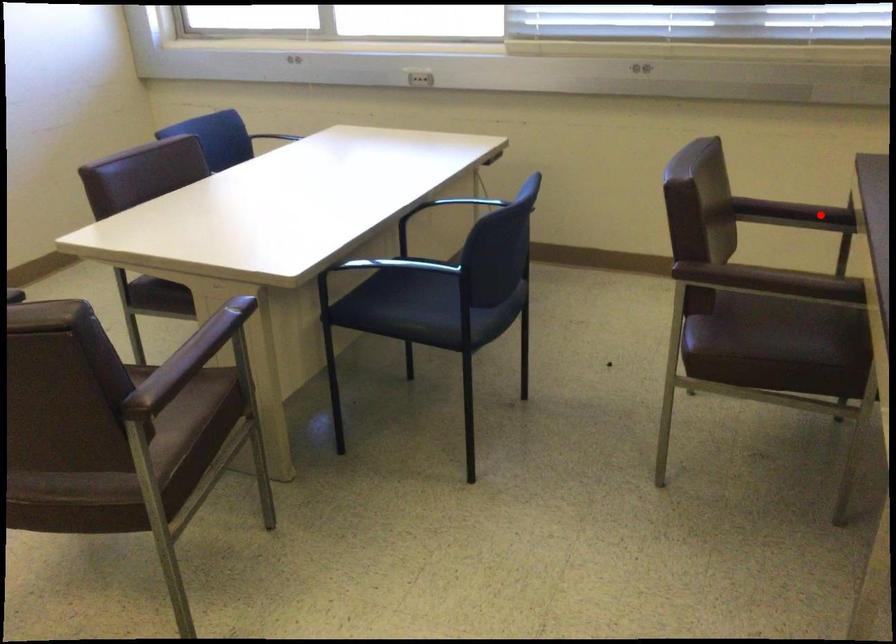
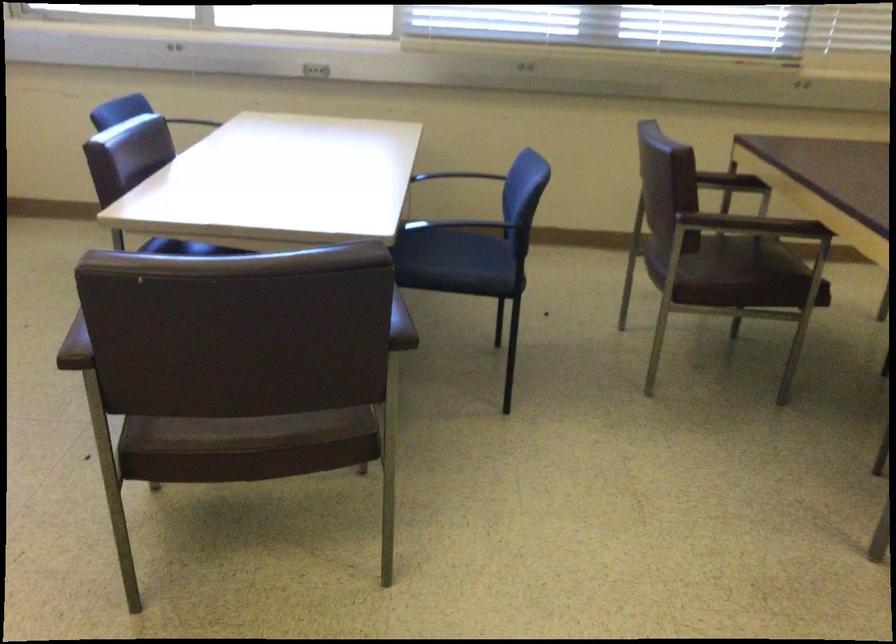
Locate, in the second image, the point that corresponds to the highlighted location in the first image.

(730, 182)